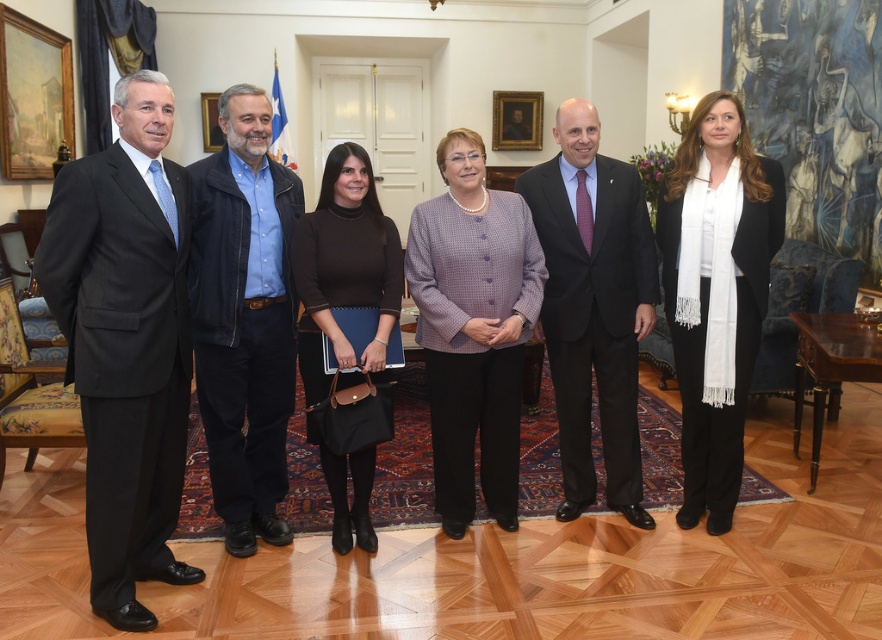
Question: Which of the following is the farthest from the observer?

Choices:
 (A) (563, 177)
 (B) (720, 445)
 (C) (235, 392)
 (D) (153, 620)

Answer: (A)

Question: Can you confirm if black suit at left is positioned above matte black suit at center?

Choices:
 (A) no
 (B) yes

Answer: (A)

Question: Which point is farther from the camera taking this photo?

Choices:
 (A) (626, 365)
 (B) (494, 481)
 (C) (155, 120)
 (D) (730, 202)

Answer: (B)

Question: Does white wool scarf at right appear on the right side of black matte sweater at center?

Choices:
 (A) yes
 (B) no

Answer: (A)

Question: Is purple textured cardigan at center to the right of black matte sweater at center from the viewer's perspective?

Choices:
 (A) no
 (B) yes

Answer: (B)

Question: Estimate the real-world distances between objects in this image. Which object is farther from the black suit at left?

Choices:
 (A) matte black suit at center
 (B) black matte sweater at center
 (C) white wool scarf at right
 (D) blue denim shirt at center

Answer: (C)